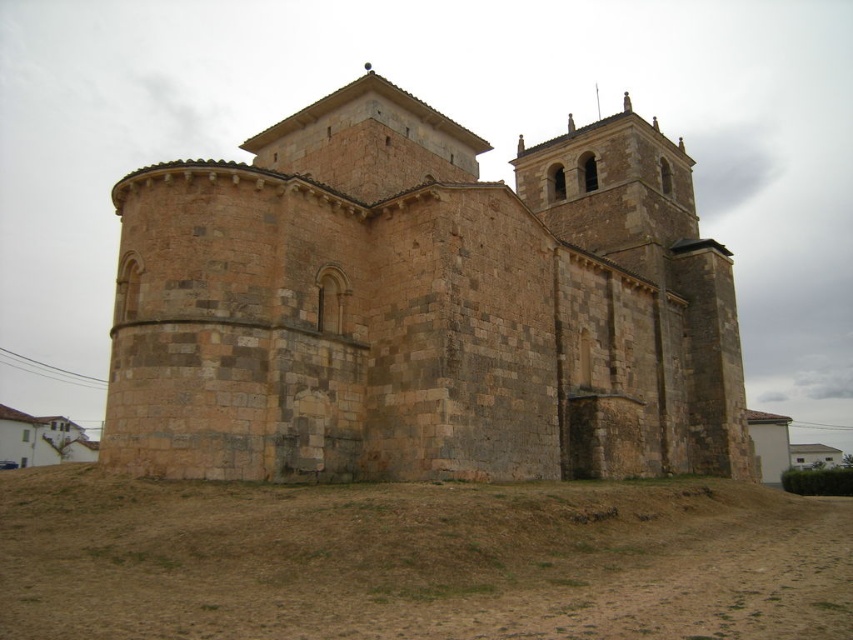
You are a construction worker needing to transport materials from the brown sandy dirt field at lower center to the brown stone church at center. Given that your equipment can only move items over distances less than 50 feet, can you safely transport the materials without needing to refuel?

The brown stone church at center and brown sandy dirt field at lower center are 50.08 feet apart. Since the distance exceeds 50 feet, the equipment cannot safely transport the materials without needing to refuel.

You are planning to build a small garden between the brown stone church at center and the brown sandy dirt field at lower center. Given their widths, which area would you choose for the garden and why?

The brown sandy dirt field at lower center has a greater width than the brown stone church at center, so the garden should be placed there as it offers more space.

Based on the photo, you are standing at the edge of the brown sandy dirt field at lower center looking towards the brown stone church at center. Which object is taller?

The brown stone church at center is taller than the brown sandy dirt field at lower center.